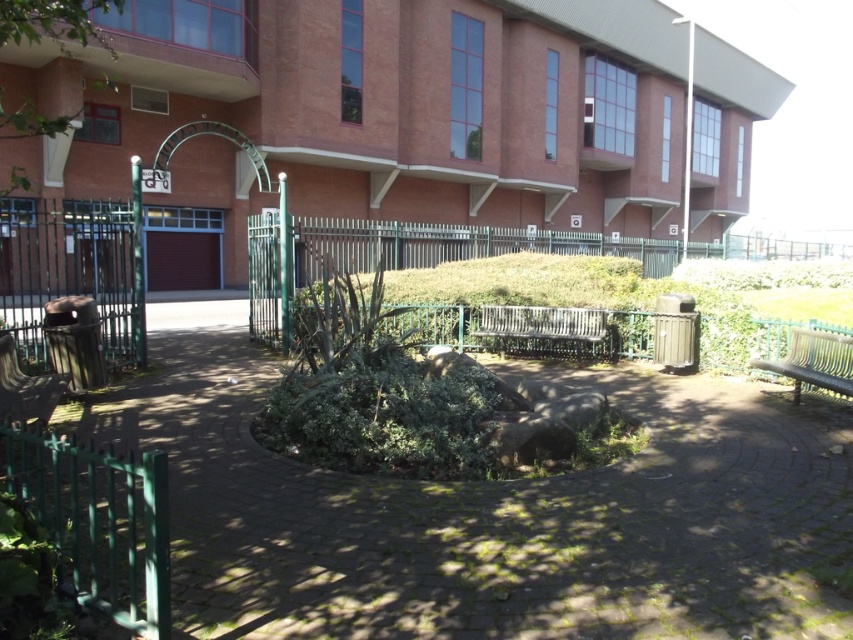
This screenshot has width=853, height=640. What are the coordinates of `green cobblestone path at center` in the screenshot? It's located at (491, 513).

Is green cobblestone path at center closer to the viewer compared to green metal bench at right?

Yes.

Where is `green cobblestone path at center`? The width and height of the screenshot is (853, 640). green cobblestone path at center is located at coordinates (491, 513).

Where is `green cobblestone path at center`? This screenshot has height=640, width=853. green cobblestone path at center is located at coordinates (491, 513).

Is point (306, 579) farther from viewer compared to point (556, 321)?

No, it is not.

Can you confirm if green cobblestone path at center is shorter than metallic silver bench at center?

Incorrect, green cobblestone path at center's height does not fall short of metallic silver bench at center's.

Between point (695, 548) and point (509, 326), which one is positioned behind?

Point (509, 326)

The image size is (853, 640). I want to click on green cobblestone path at center, so click(x=491, y=513).

Consider the image. Can you confirm if green metal bench at right is shorter than metallic silver bench at center?

Incorrect, green metal bench at right's height does not fall short of metallic silver bench at center's.

Does green metal bench at right have a larger size compared to metallic silver bench at center?

No, green metal bench at right is not bigger than metallic silver bench at center.

What are the coordinates of `green metal bench at right` in the screenshot? It's located at (814, 362).